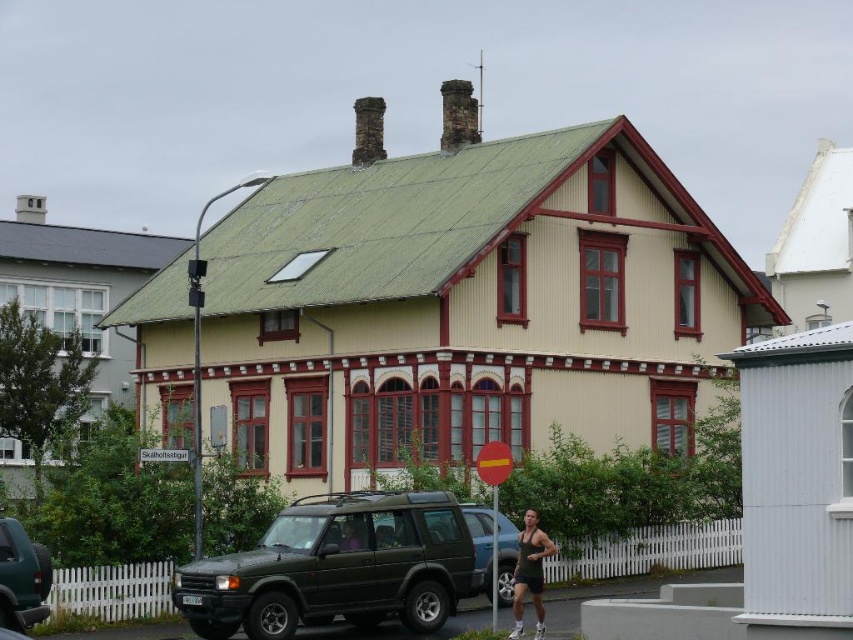
You are standing in front of the two story residential building and see both the dark green tank top at lower center and the purple fabric shirt at center. Which one is positioned more to the east side of the building?

The dark green tank top at lower center is positioned more to the east side of the building because it is to the right of the purple fabric shirt at center, and in the scene, the building is oriented such that east is to the right from the observer perspective.